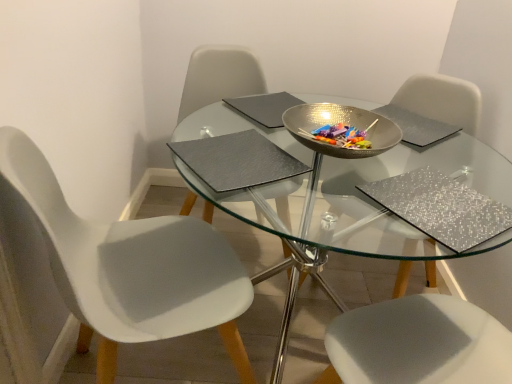
Question: Based on their sizes in the image, would you say silver textured pad at upper center, arranged as the first pad when viewed from the right, is bigger or smaller than silver glittery placemat at lower right, positioned as the first place mat in right-to-left order?

Choices:
 (A) big
 (B) small

Answer: (B)

Question: From their relative heights in the image, would you say silver textured pad at upper center, arranged as the first pad when viewed from the right, is taller or shorter than silver glittery placemat at lower right, positioned as the first place mat in right-to-left order?

Choices:
 (A) tall
 (B) short

Answer: (B)

Question: Considering the real-world distances, which object is closest to the shiny metallic bowl at center?

Choices:
 (A) matte gray chair at center, the second chair positioned from the left
 (B) silver textured pad at upper center, which is the 2th pad in left-to-right order
 (C) white matte chair at left, which appears as the 1th chair when viewed from the left
 (D) clear glass table at center
 (E) silver glittery placemat at lower right, positioned as the first place mat in right-to-left order

Answer: (B)

Question: Which is nearer to the silver glittery placemat at lower right, positioned as the first place mat in right-to-left order?

Choices:
 (A) shiny metallic bowl at center
 (B) matte gray chair at center, which is counted as the second chair, starting from the right
 (C) silver textured pad at upper center, which is the 2th pad in left-to-right order
 (D) matte gray pad at center, which ranks as the 1th pad in left-to-right order
 (E) matte gray place mat at center, which is counted as the 2th place mat, starting from the right

Answer: (A)